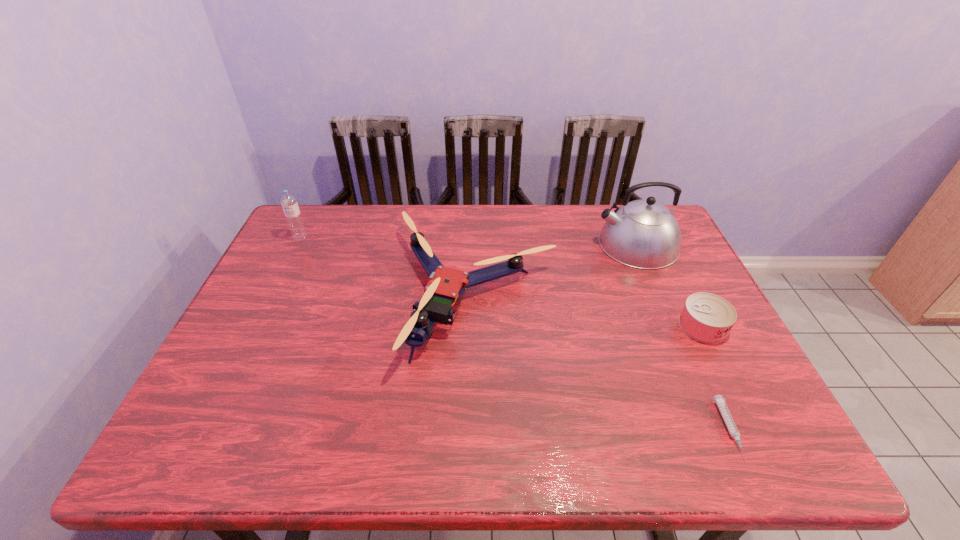
The width and height of the screenshot is (960, 540). I want to click on empty space that is in between the shortest object and the kettle, so click(x=684, y=336).

Identify the location of free space between the third tallest object and the can. The width and height of the screenshot is (960, 540). (589, 311).

At what (x,y) coordinates should I click in order to perform the action: click on free space between the shortest object and the fourth shortest object. Please return your answer as a coordinate pair (x, y). The width and height of the screenshot is (960, 540). Looking at the image, I should click on (515, 333).

Locate an element on the screen. The height and width of the screenshot is (540, 960). vacant space in between the can and the kettle is located at coordinates (670, 285).

Where is `vacant space in between the shortest object and the water bottle`? vacant space in between the shortest object and the water bottle is located at coordinates (515, 333).

Identify the location of vacant space in between the water bottle and the kettle. (468, 241).

Locate an element on the screen. vacant space in between the water bottle and the tallest object is located at coordinates (468, 241).

Image resolution: width=960 pixels, height=540 pixels. Identify the location of free point between the water bottle and the nearest object. (515, 333).

Find the location of a particular element. This screenshot has height=540, width=960. free point between the leftmost object and the nearest object is located at coordinates (515, 333).

Locate an element on the screen. object that is the second nearest to the third tallest object is located at coordinates (719, 400).